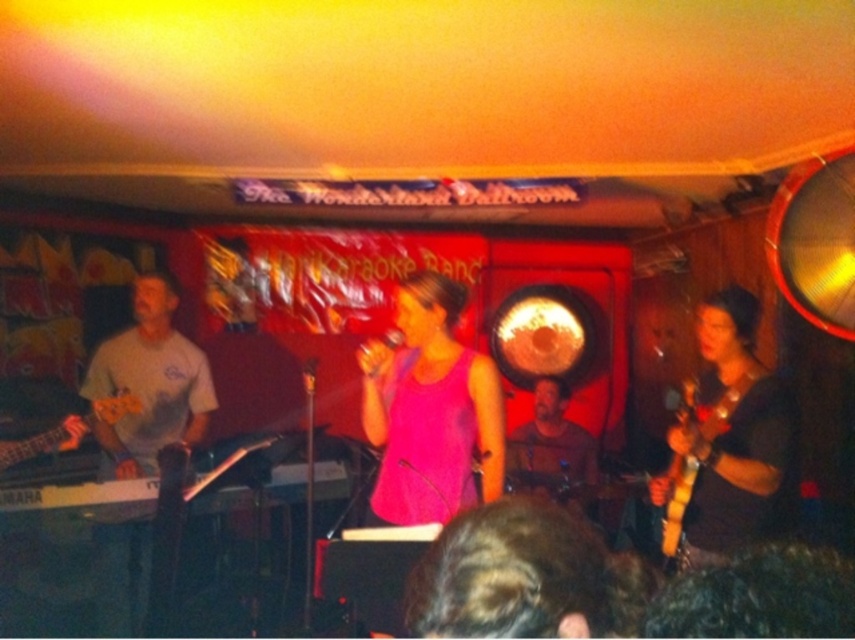
Question: Considering the relative positions of black matte guitar at right and orange glossy guitar at left in the image provided, where is black matte guitar at right located with respect to orange glossy guitar at left?

Choices:
 (A) above
 (B) below

Answer: (A)

Question: Does black matte guitar at right have a smaller size compared to matte brown guitar at center?

Choices:
 (A) no
 (B) yes

Answer: (B)

Question: Which of the following is the closest to the observer?

Choices:
 (A) pink matte tank top at center
 (B) white matte shirt at left
 (C) black matte guitar at right
 (D) matte brown guitar at center

Answer: (A)

Question: Is matte brown guitar at center behind yellow wood guitar at right?

Choices:
 (A) yes
 (B) no

Answer: (A)

Question: Which is farther from the black matte guitar at right?

Choices:
 (A) orange glossy guitar at left
 (B) white matte shirt at left
 (C) pink matte tank top at center

Answer: (A)

Question: Considering the real-world distances, which object is closest to the black matte guitar at right?

Choices:
 (A) matte brown guitar at center
 (B) yellow wood guitar at right

Answer: (B)